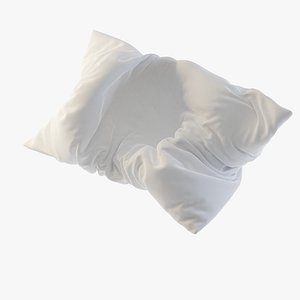
Show me all visible where the pillow bends at the center in the image. Your answer should be formatted as a list of tuples, i.e. [(x1, y1), (x2, y2), ...], where each tuple contains the x and y coordinates of a point satisfying the conditions above.

[(146, 119)]